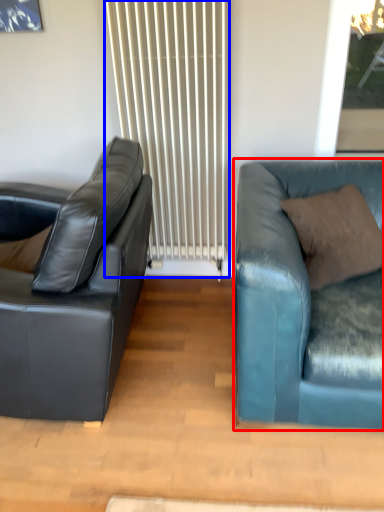
Question: Which object is closer to the camera taking this photo, studio couch (highlighted by a red box) or radiator (highlighted by a blue box)?

Choices:
 (A) studio couch
 (B) radiator

Answer: (A)